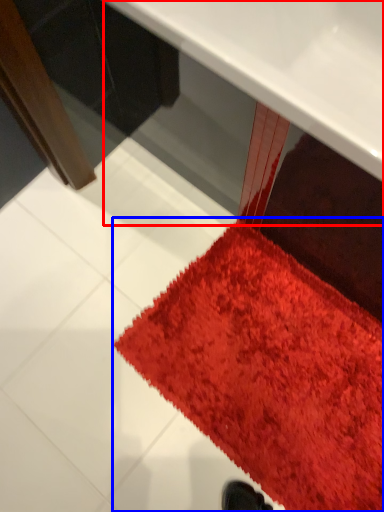
Question: Among these objects, which one is nearest to the camera, table (highlighted by a red box) or mat (highlighted by a blue box)?

Choices:
 (A) table
 (B) mat

Answer: (A)